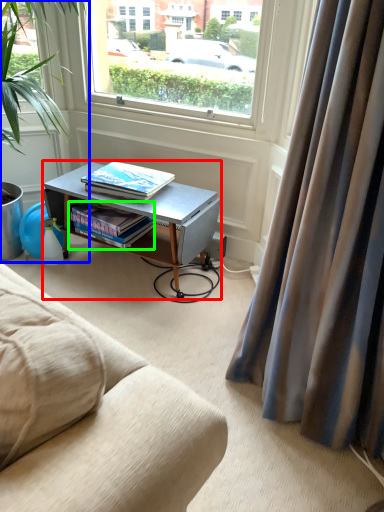
Question: Estimate the real-world distances between objects in this image. Which object is farther from desk (highlighted by a red box), houseplant (highlighted by a blue box) or book (highlighted by a green box)?

Choices:
 (A) houseplant
 (B) book

Answer: (A)